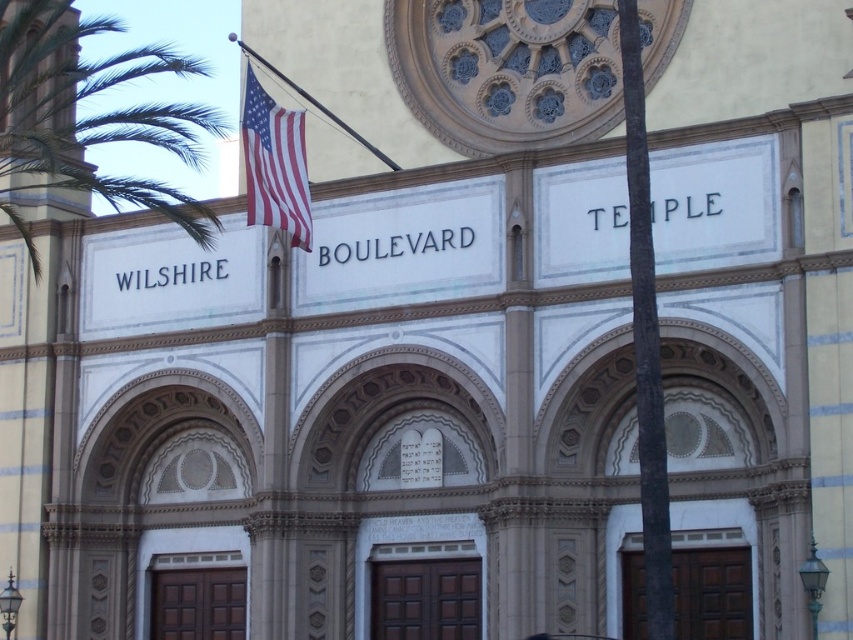
Question: Is green leafy palm tree at left above american flag at upper left?

Choices:
 (A) no
 (B) yes

Answer: (B)

Question: Does green leafy palm tree at left have a smaller size compared to american flag at upper left?

Choices:
 (A) no
 (B) yes

Answer: (A)

Question: Among these points, which one is farthest from the camera?

Choices:
 (A) (200, 221)
 (B) (247, 109)

Answer: (A)

Question: Which of the following is the closest to the observer?

Choices:
 (A) american flag at upper left
 (B) green leafy palm tree at left

Answer: (B)

Question: Which of the following is the closest to the observer?

Choices:
 (A) green leafy palm tree at left
 (B) american flag at upper left

Answer: (A)

Question: Does green leafy palm tree at left appear over american flag at upper left?

Choices:
 (A) no
 (B) yes

Answer: (B)